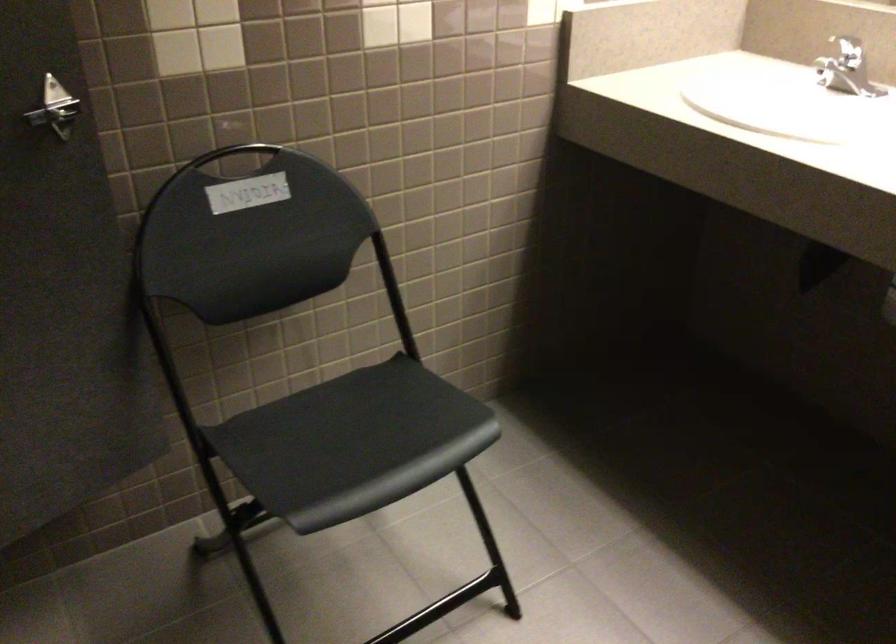
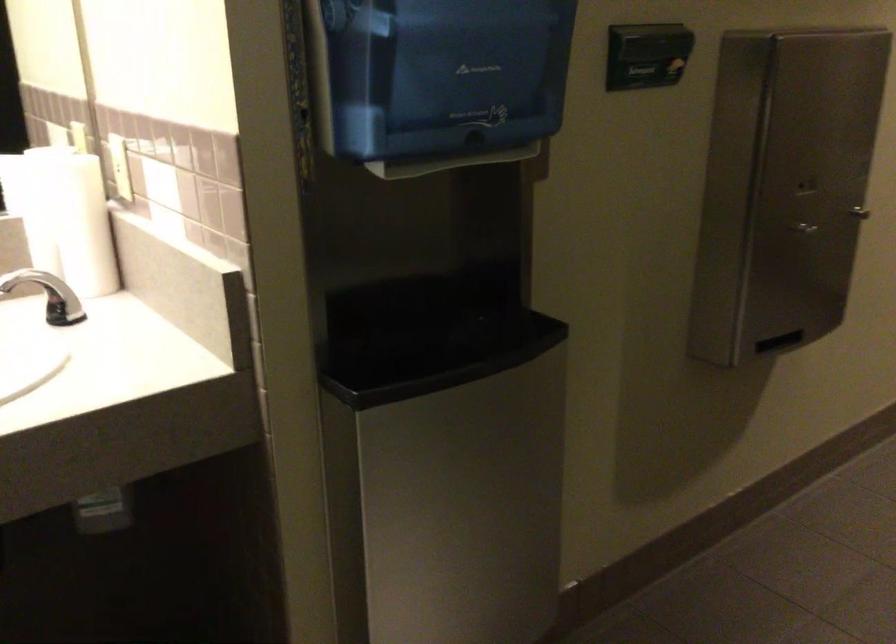
Consider the image. How did the camera likely rotate?

The camera rotated toward right-down.